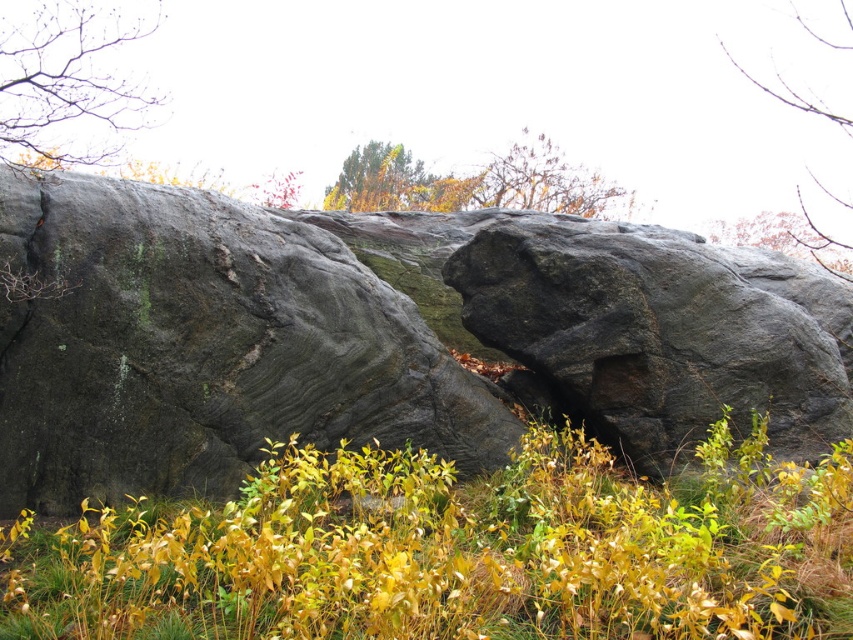
You are an artist sketching the landscape and want to draw the bare branches at upper left and the green leafy tree at upper center. Which object is located to the left of the other?

The bare branches at upper left is positioned on the left side of green leafy tree at upper center.

You are an artist sketching the landscape and want to capture the size relationship between the bare branches at upper left and the brown textured tree at upper center. Which one should you draw larger in your sketch?

The brown textured tree at upper center should be drawn larger in the sketch since it is bigger than the bare branches at upper left according to the description.